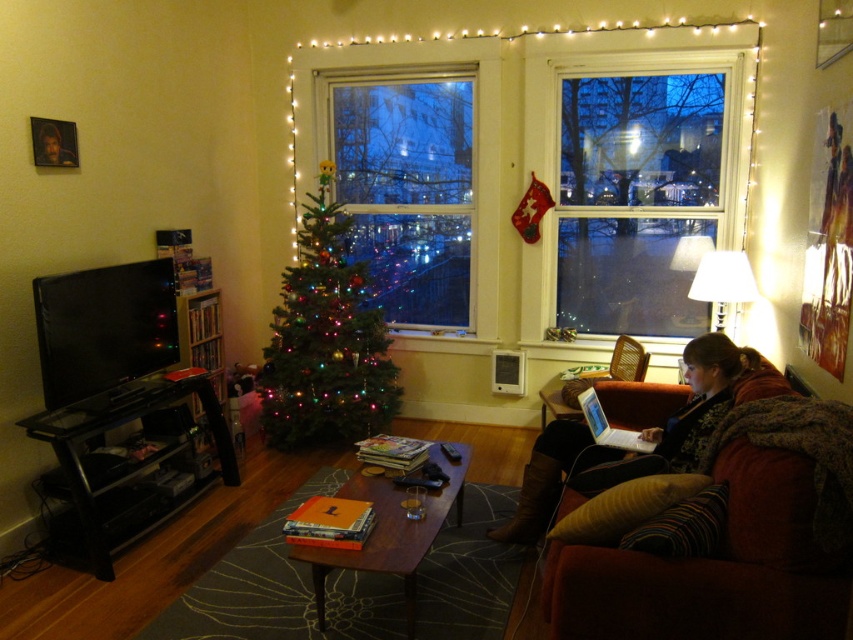
In the scene shown: You are standing in the living room and want to place a new decoration between the two points. Which point is further away from you, point [645,230] or point [68,164]?

Point [645,230] is behind point [68,164], so it is further away from you.

What is the object located at the coordinates point (407, 189) in the image?

The point (407, 189) indicates an illuminated glass window at center.